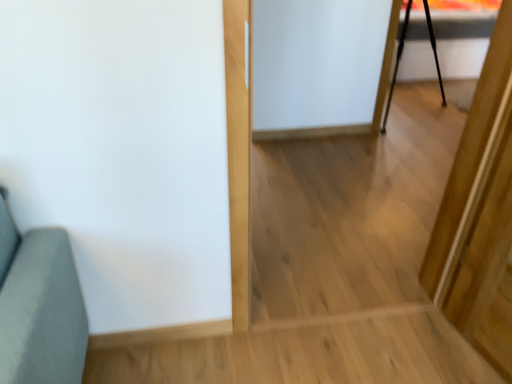
The image size is (512, 384). What are the coordinates of `light brown wood floor at lower left` in the screenshot? It's located at (307, 353).

What do you see at coordinates (307, 353) in the screenshot? I see `light brown wood floor at lower left` at bounding box center [307, 353].

The image size is (512, 384). Identify the location of light brown wood floor at lower left. [307, 353].